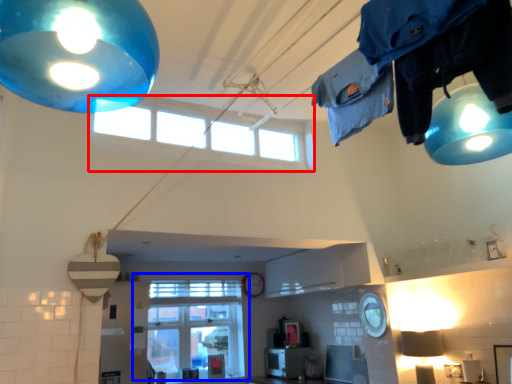
Question: Among these objects, which one is farthest to the camera, window (highlighted by a red box) or window (highlighted by a blue box)?

Choices:
 (A) window
 (B) window

Answer: (B)